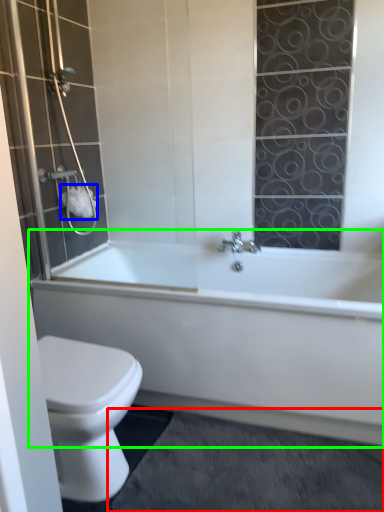
Question: Which is farther away from bath mat (highlighted by a red box)? toilet paper (highlighted by a blue box) or bathtub (highlighted by a green box)?

Choices:
 (A) toilet paper
 (B) bathtub

Answer: (A)